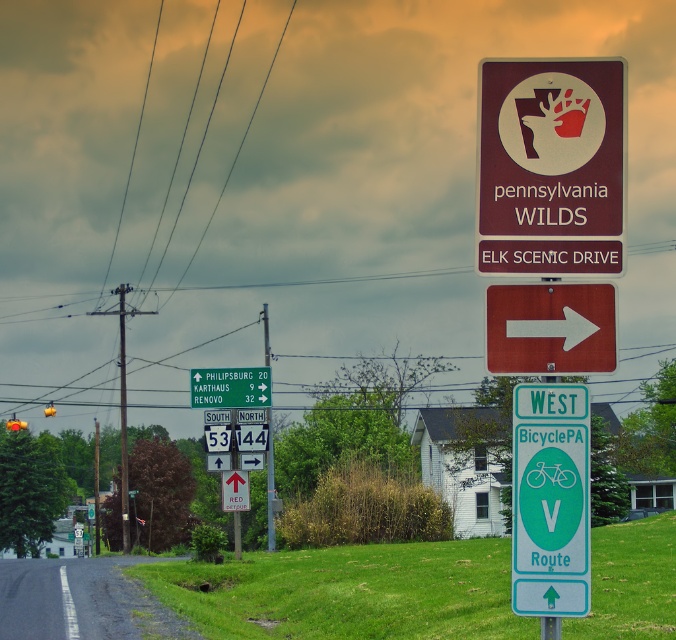
You are driving along a rural road and see the green plastic road sign at upper center and the metallic signpost at center. Which object takes up more space in the scene?

The metallic signpost at center takes up more space in the scene than the green plastic road sign at upper center because the green plastic road sign at upper center occupies less space than metallic signpost at center.

You are a cyclist planning to ride along the road shown in the image. You notice the green plastic bicycle sign at right and the green plastic road sign at upper center. Which of these two signs is smaller in size?

The green plastic bicycle sign at right has a smaller size compared to the green plastic road sign at upper center, so the green plastic bicycle sign at right is the smaller one.

You are standing at the center of the road in the image and want to find the green plastic bicycle sign at right. In which direction should you look relative to your position?

The green plastic bicycle sign at right is located at the right side of the image, so you should look to your right to find it.